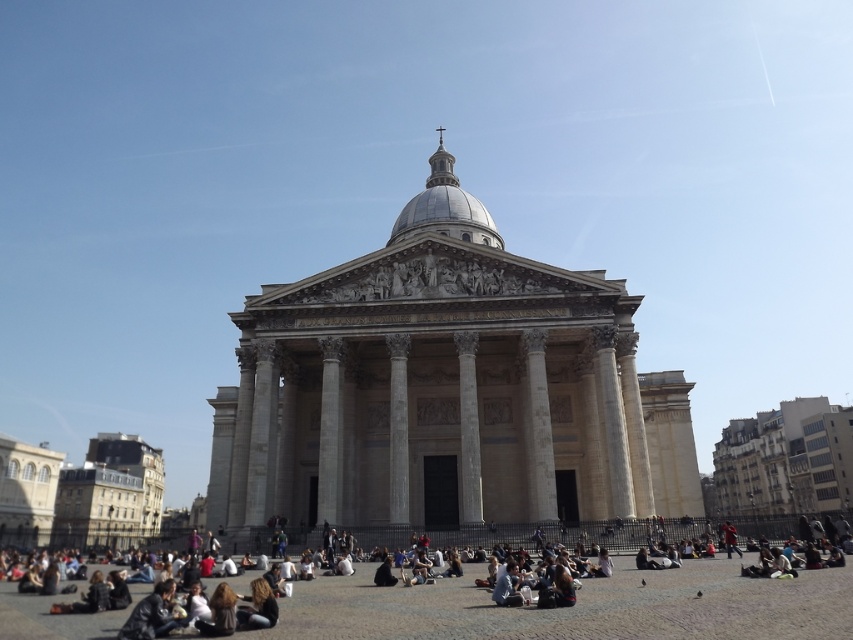
You are a tourist standing in front of the white marble building at center and the dark brown hair at lower center. Which object is positioned higher in the image?

The white marble building at center is located above the dark brown hair at lower center, so it is positioned higher in the image.

You are standing in front of the grand neoclassical building and notice the dark gray stone people at lower center. Where exactly are they positioned relative to the building?

The dark gray stone people at lower center are positioned at coordinates approximately 0.947 on the x axis and 0.679 on the y axis relative to the building.